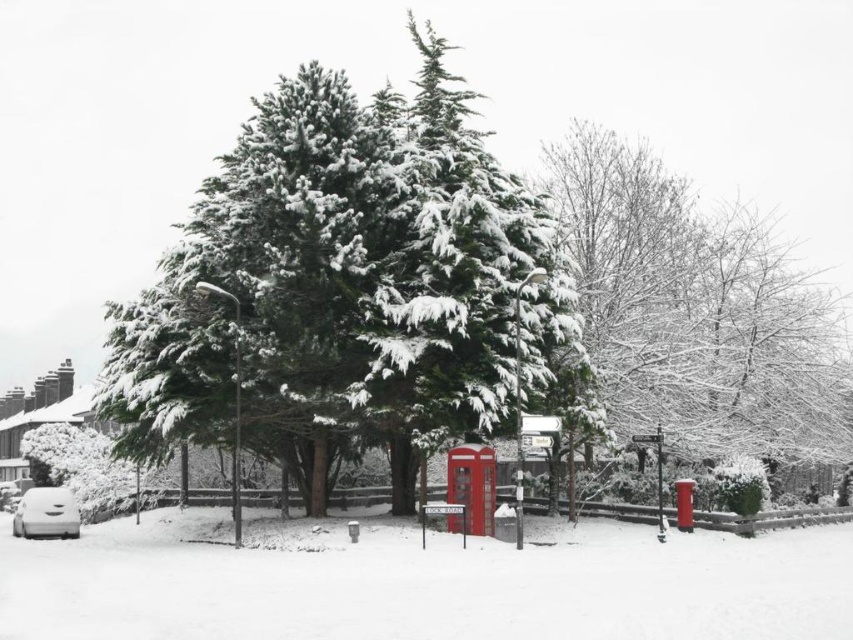
You are a photographer planning to capture the green textured tree at center and the metallic red phone box at center in a single frame. Which object should you focus on first to ensure both are in the frame without moving the camera?

You should focus on the metallic red phone box at center first because it is smaller than the green textured tree at center, so it will be easier to fit both into the frame by centering the larger tree and adjusting for the smaller phone box.

You are a delivery robot with a maximum range of 15 meters. You are currently positioned at the white matte car at lower left and need to deliver a package to the metallic red phone box at center. Can you complete the delivery without needing a recharge?

The distance between the metallic red phone box at center and the white matte car at lower left is 13.61 meters. Since your maximum range is 15 meters, you can complete the delivery without needing a recharge.

You are a photographer planning to capture a winter landscape photo that includes both the green textured tree at center and the metallic red phone box at center. Based on their sizes, which object should you focus on to ensure both are fully visible in the frame?

The green textured tree at center is taller than the metallic red phone box at center, so focusing on the tree will ensure both are fully visible in the frame as it accommodates the smaller phone box.